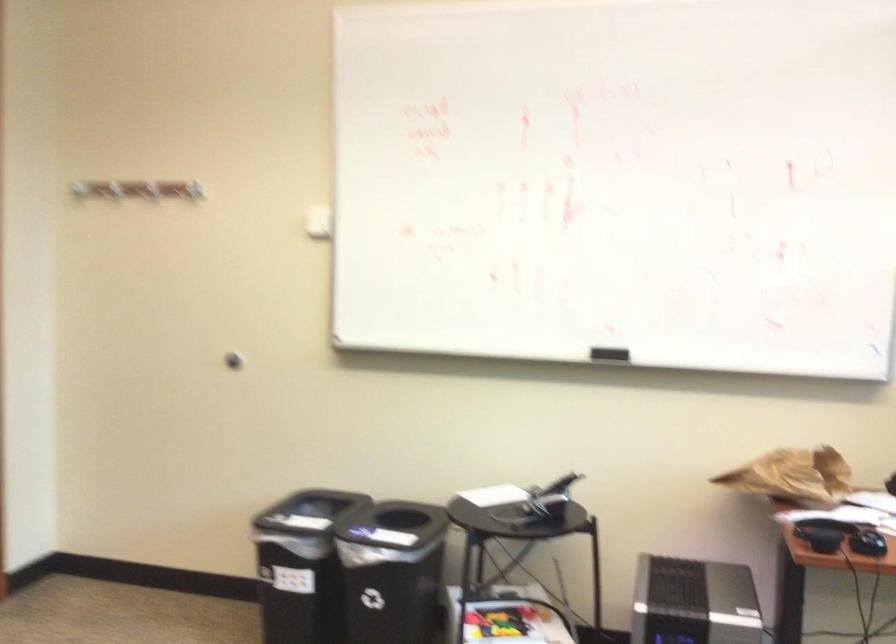
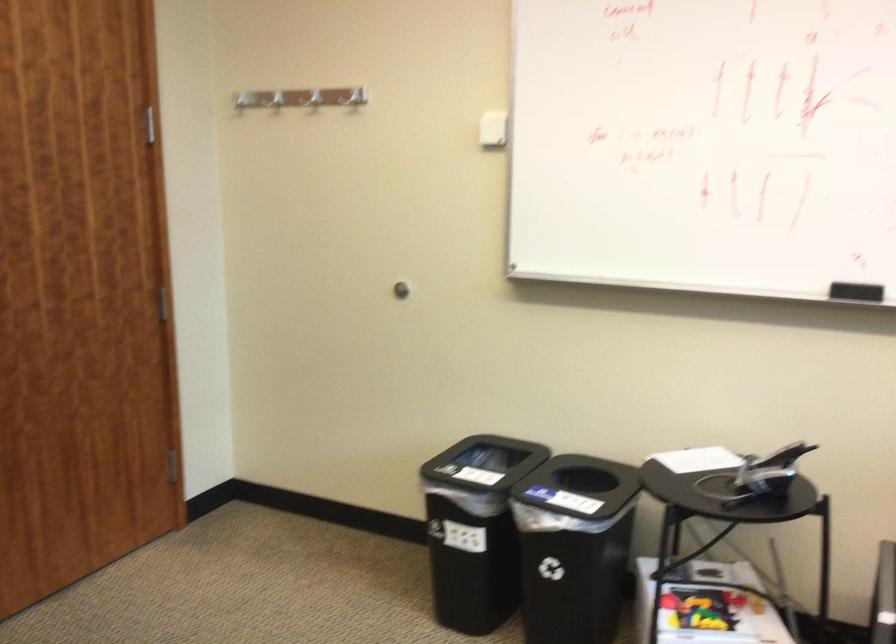
Find the pixel in the second image that matches pixel 304 573 in the first image.

(475, 529)